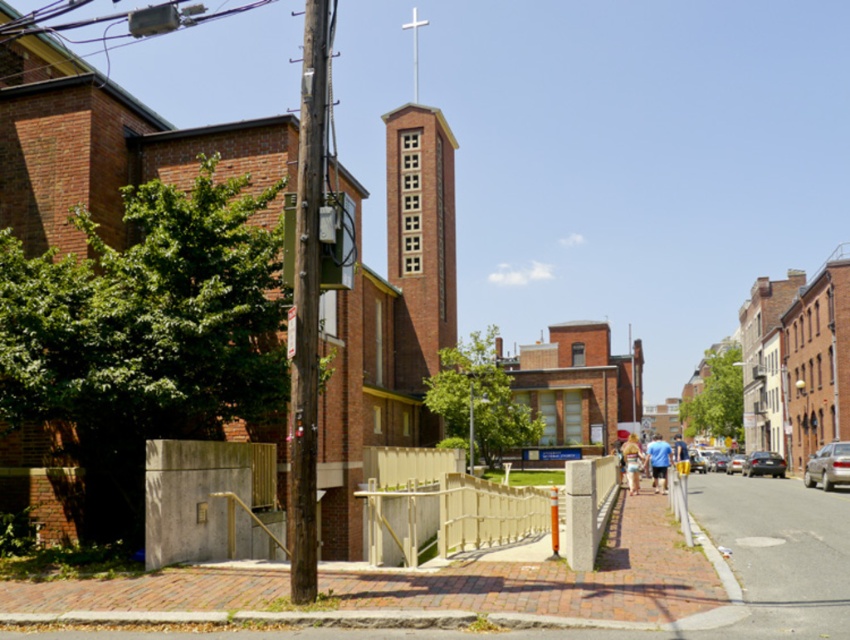
Is smooth asphalt road at lower right positioned in front of blue fabric shirt at center?

That is True.

Does point (839, 604) come in front of point (687, 458)?

Yes, point (839, 604) is closer to viewer.

Identify the location of smooth asphalt road at lower right. (779, 554).

What do you see at coordinates (828, 465) in the screenshot? The image size is (850, 640). I see `silver metallic sedan at right` at bounding box center [828, 465].

Identify the location of silver metallic sedan at right. (828, 465).

Where is `silver metallic sedan at right`? silver metallic sedan at right is located at coordinates (828, 465).

Is point (712, 452) less distant than point (740, 465)?

That is False.

Is point (718, 465) positioned after point (728, 464)?

Yes, point (718, 465) is behind point (728, 464).

Locate an element on the screen. silver metallic sedan at center is located at coordinates (717, 461).